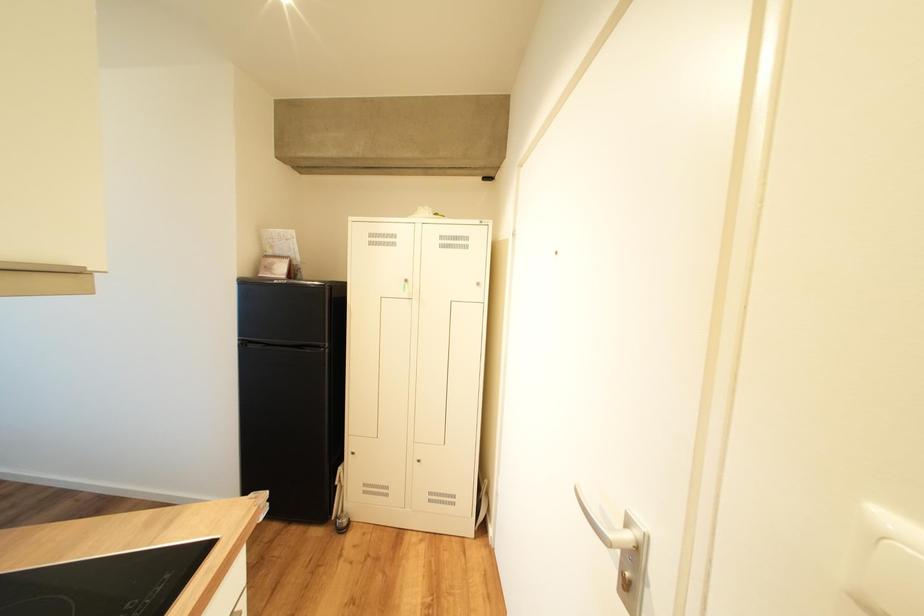
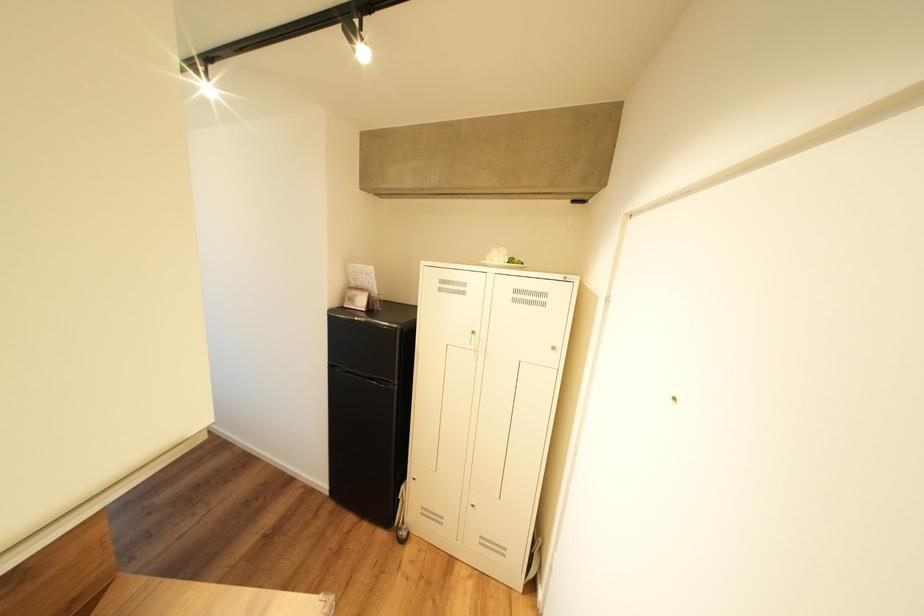
Question: The camera is either moving clockwise (left) or counter-clockwise (right) around the object. The first image is from the beginning of the video and the second image is from the end. Is the camera moving left or right when shooting the video?

Choices:
 (A) Left
 (B) Right

Answer: (B)